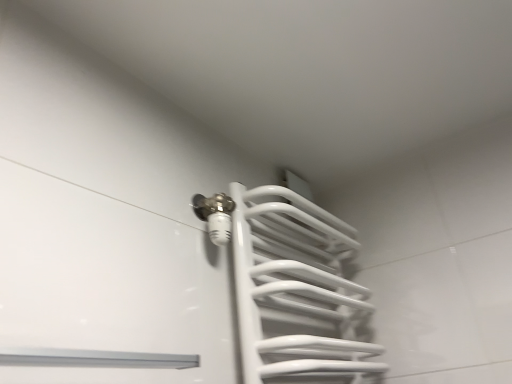
What do you see at coordinates (297, 292) in the screenshot? I see `white glossy towel rack at upper right` at bounding box center [297, 292].

In order to click on white glossy towel rack at upper right in this screenshot , I will do `click(297, 292)`.

Identify the location of white glossy towel rack at upper right. (297, 292).